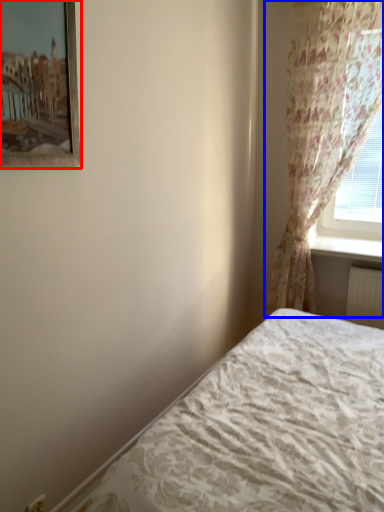
Question: Which of the following is the closest to the observer, picture frame (highlighted by a red box) or curtain (highlighted by a blue box)?

Choices:
 (A) picture frame
 (B) curtain

Answer: (A)